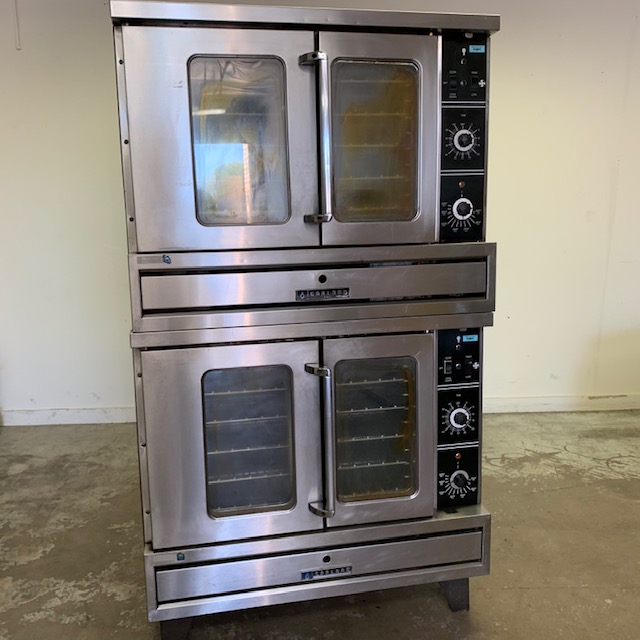
The height and width of the screenshot is (640, 640). In order to click on professional oven unit in this screenshot , I will do `click(134, 44)`.